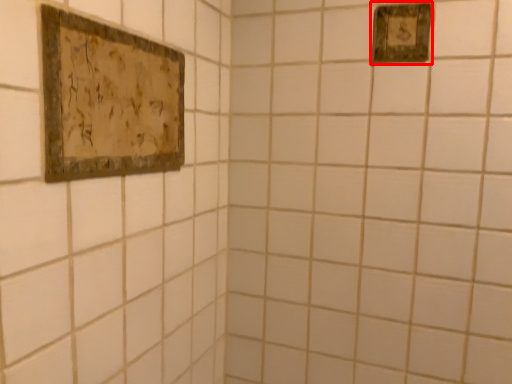
Question: From the image's perspective, where is picture frame (annotated by the red box) located in relation to picture frame in the image?

Choices:
 (A) below
 (B) above

Answer: (B)